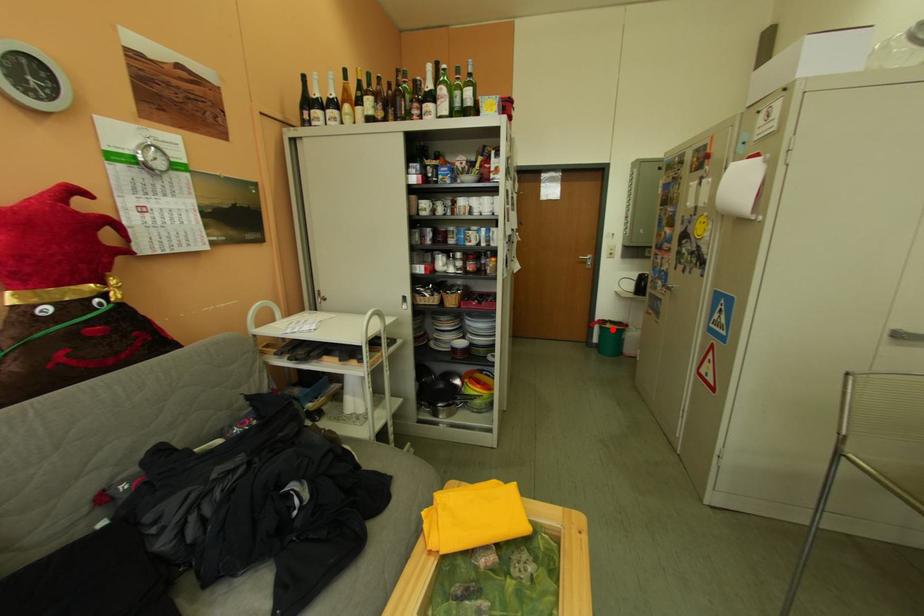
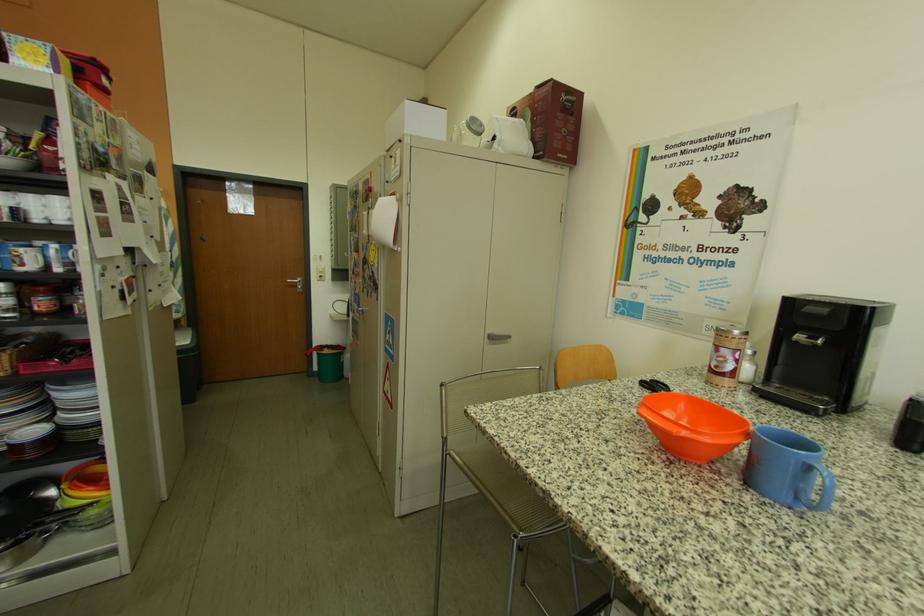
Locate, in the second image, the point that corresponds to the highlighted location in the first image.

(331, 357)